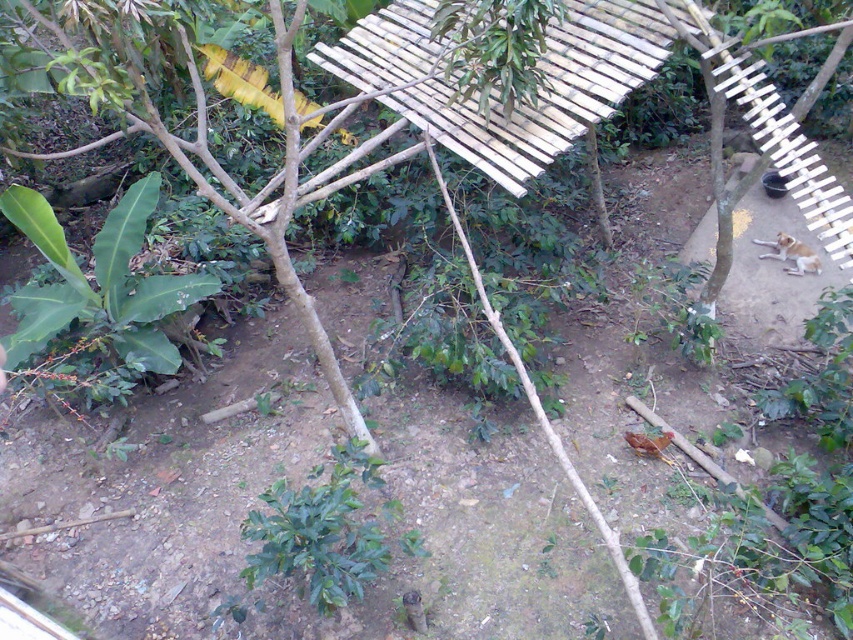
You are standing at the point with coordinates point (143, 209) and want to walk towards the banana plant on the left side. Will you pass through point (379, 88) on your way?

Yes, because point (379, 88) is in front of point (143, 209), so walking towards the banana plant on the left side would require passing through point (379, 88).

You are a gardener who wants to water both the green leafy plant at lower left and the green leafy plant at center. If your watering can has a range of 4 feet, can you water both plants without moving the watering can?

The green leafy plant at lower left is 4.59 feet away from the green leafy plant at center. Since the distance between them exceeds the watering can range of 4 feet, you cannot water both plants without moving the watering can.

Consider the image. You are planning to place a small potted plant between the wooden slats at center and the green leafy plant at center. Given their sizes, which one would you position closer to the potted plant to ensure there is enough space?

Since the wooden slats at center is bigger than the green leafy plant at center, you should position the green leafy plant at center closer to the potted plant to allow sufficient space between the larger wooden slats at center and the new plant.